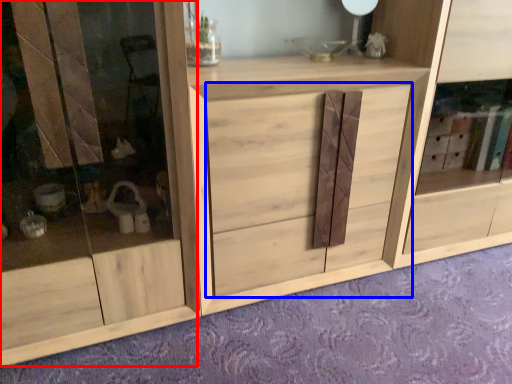
Question: Among these objects, which one is farthest to the camera, screen door (highlighted by a red box) or drawer (highlighted by a blue box)?

Choices:
 (A) screen door
 (B) drawer

Answer: (B)